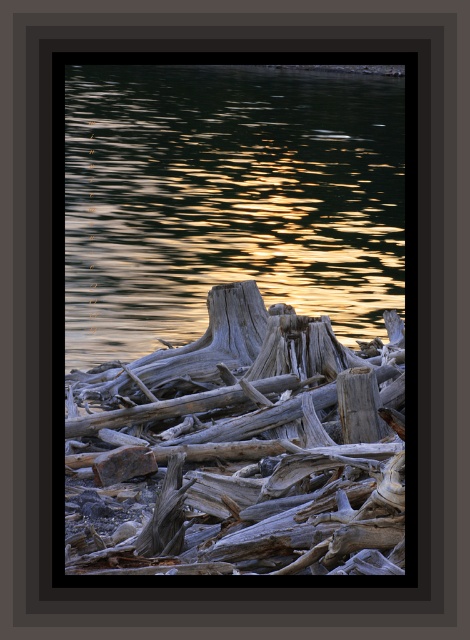
You are standing at the edge of the scene and want to cross to the other side. You see the glistening water at center and the gray rough wood at center. Which path is wider for you to walk through?

The glistening water at center might be wider than gray rough wood at center, so the glistening water at center is likely the wider path for walking through.

You are an artist planning to paint the scene. You need to know which object at the center has a smaller width to decide where to focus your brushstrokes. Which one is narrower between the gray weathered wood at center and the gray rough wood at center?

The gray weathered wood at center has a lesser width compared to the gray rough wood at center, so it is narrower.